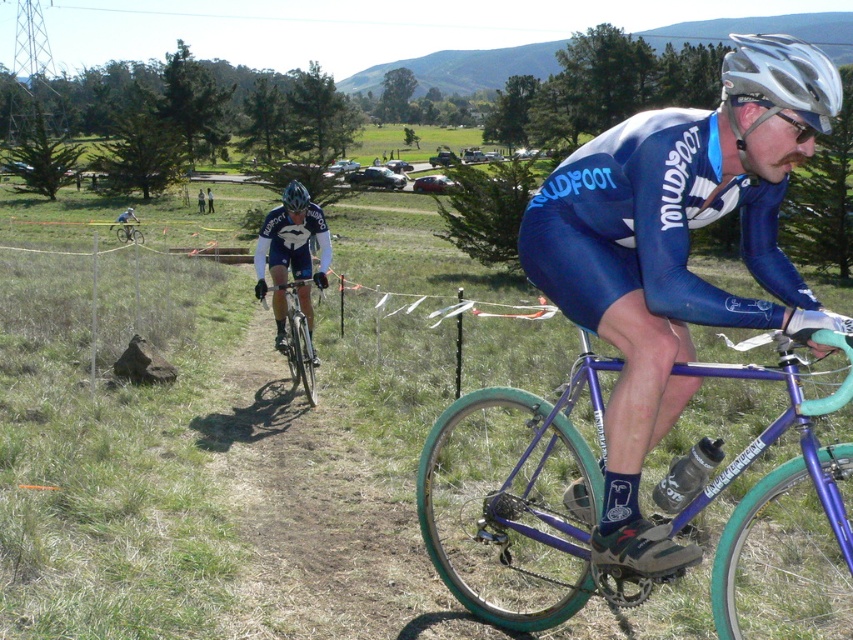
You are a photographer trying to capture a photo of the shiny purple bicycle at center and the silver metallic helmet at upper right. Which object should you focus on first if you want to include both in your shot without moving the camera?

The shiny purple bicycle at center should be focused on first because it is positioned on the left side of the silver metallic helmet at upper right, so adjusting focus to the left will ensure both are in frame.

You are a spectator at the cyclocross race. You see the shiny purple bicycle at center and the silver metallic helmet at upper right. Which object is closer to you?

The shiny purple bicycle at center is closer to you because the silver metallic helmet at upper right is behind it.